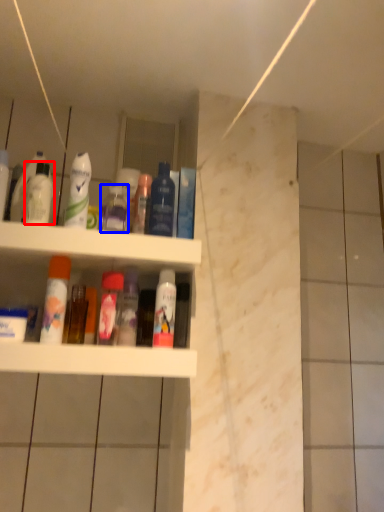
Question: Which object is further to the camera taking this photo, mouthwash (highlighted by a red box) or cleaning product (highlighted by a blue box)?

Choices:
 (A) mouthwash
 (B) cleaning product

Answer: (B)